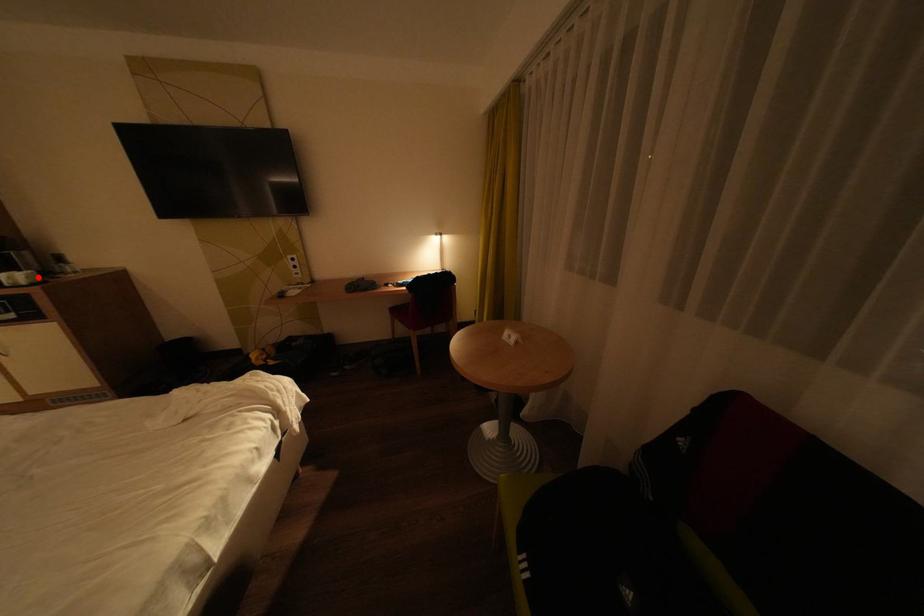
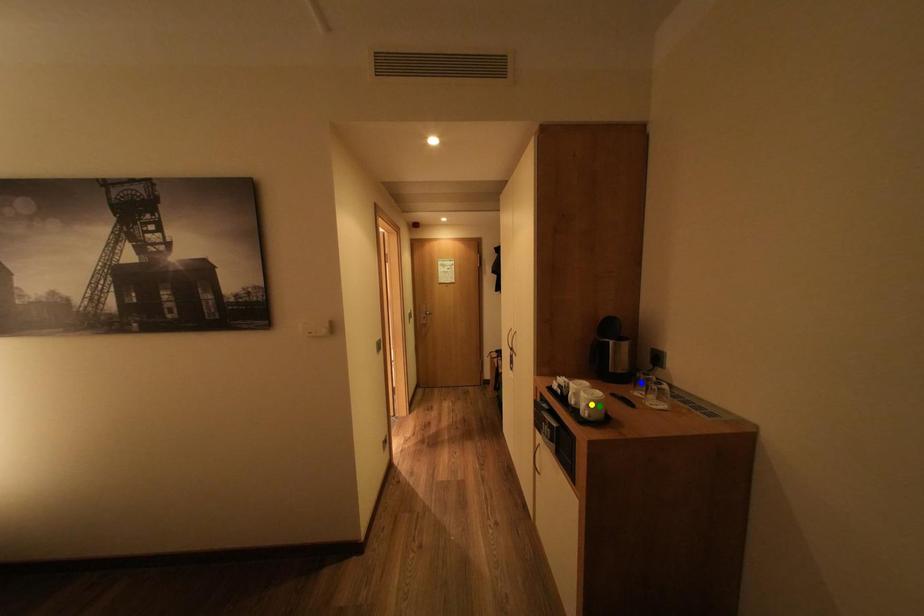
Question: I am providing you with two images of the same scene from different viewpoints. A red point is marked on the first image. You are given multiple points on the second image. Can you choose the point in image 2 that corresponds to the point in image 1?

Choices:
 (A) green point
 (B) blue point
 (C) yellow point

Answer: (A)